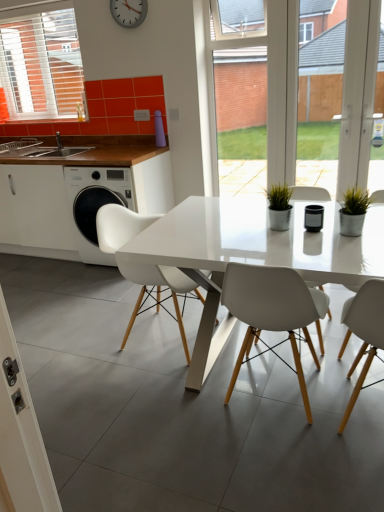
Question: From a real-world perspective, is brown wood countertop at left below white glossy table at center?

Choices:
 (A) yes
 (B) no

Answer: (B)

Question: Is brown wood countertop at left wider than white glossy table at center?

Choices:
 (A) yes
 (B) no

Answer: (B)

Question: From the image's perspective, does brown wood countertop at left appear lower than white glossy table at center?

Choices:
 (A) no
 (B) yes

Answer: (A)

Question: Is brown wood countertop at left with white glossy table at center?

Choices:
 (A) yes
 (B) no

Answer: (B)

Question: Considering the relative sizes of brown wood countertop at left and white glossy table at center in the image provided, is brown wood countertop at left taller than white glossy table at center?

Choices:
 (A) yes
 (B) no

Answer: (B)

Question: Is brown wood countertop at left thinner than white glossy table at center?

Choices:
 (A) no
 (B) yes

Answer: (B)

Question: Is white matte cabinet at left thinner than silver metallic clock at upper center?

Choices:
 (A) no
 (B) yes

Answer: (A)

Question: Does white matte cabinet at left appear on the right side of silver metallic clock at upper center?

Choices:
 (A) yes
 (B) no

Answer: (B)

Question: From a real-world perspective, is white matte cabinet at left over silver metallic clock at upper center?

Choices:
 (A) yes
 (B) no

Answer: (B)

Question: Is white matte cabinet at left completely or partially outside of silver metallic clock at upper center?

Choices:
 (A) yes
 (B) no

Answer: (A)

Question: Does white matte cabinet at left appear on the left side of silver metallic clock at upper center?

Choices:
 (A) yes
 (B) no

Answer: (A)

Question: From the image's perspective, does white matte cabinet at left appear higher than silver metallic clock at upper center?

Choices:
 (A) no
 (B) yes

Answer: (A)

Question: Is white glossy table at center positioned before silver metallic clock at upper center?

Choices:
 (A) yes
 (B) no

Answer: (A)